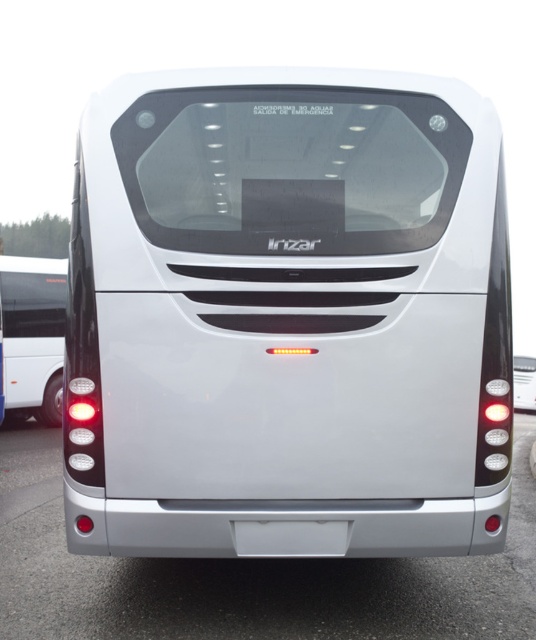
You are standing behind the bus and want to place a sticker on the bus. The sticker needs to be placed on the object that is positioned higher up. Which object should you choose between the white glossy bus at center and the glossy metallic bus at lower center?

The white glossy bus at center is located above the glossy metallic bus at lower center, so you should place the sticker on the white glossy bus at center.

Looking at this image, you are a photographer trying to capture both the glossy metallic bus at lower center and the silver metallic bus at left in a single frame. Given their sizes, which bus should you position closer to the camera to ensure both appear roughly the same size in the photo?

The glossy metallic bus at lower center has a smaller size compared to silver metallic bus at left. To make them appear similar in size in the photo, you should position the smaller glossy metallic bus at lower center closer to the camera and the larger silver metallic bus at left farther away.

You are standing 10 feet away from the white glossy bus at center. Can you comfortably walk around it without needing to move closer than your current distance?

The distance between you and the white glossy bus at center is 10.95 feet, so yes, you can comfortably walk around it without needing to move closer than your current distance of 10 feet.